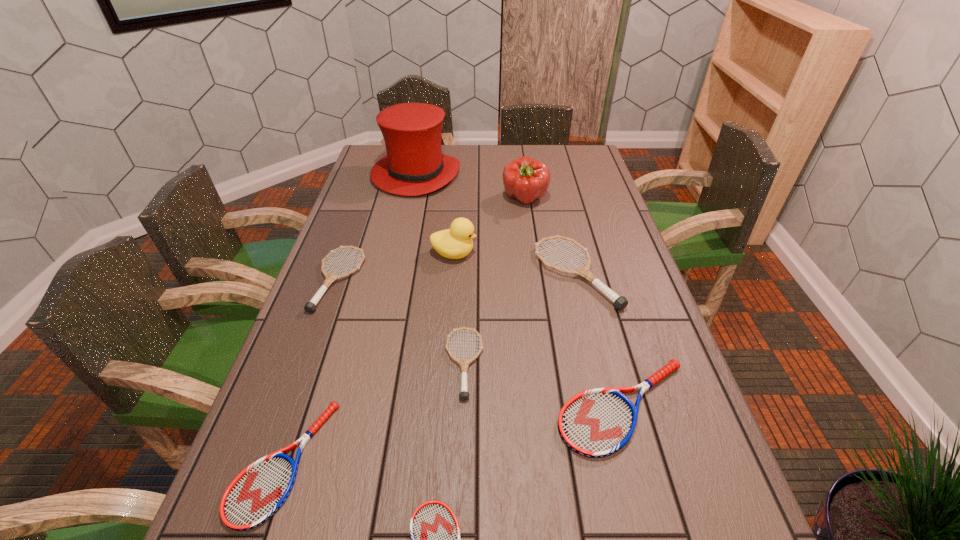
Choose which gray tennis racket is the second nearest neighbor to the fourth tallest object. Please provide its 2D coordinates. Your answer should be formatted as a tuple, i.e. [(x, y)], where the tuple contains the x and y coordinates of a point satisfying the conditions above.

[(310, 307)]

Identify which gray tennis racket is the second nearest to the smallest gray tennis racket. Please provide its 2D coordinates. Your answer should be formatted as a tuple, i.e. [(x, y)], where the tuple contains the x and y coordinates of a point satisfying the conditions above.

[(310, 307)]

The width and height of the screenshot is (960, 540). What are the coordinates of `blue tennis racket that is the third closest to the rightmost gray tennis racket` in the screenshot? It's located at (258, 492).

Point out which blue tennis racket is positioned as the nearest to the nearest gray tennis racket. Please provide its 2D coordinates. Your answer should be formatted as a tuple, i.e. [(x, y)], where the tuple contains the x and y coordinates of a point satisfying the conditions above.

[(596, 423)]

This screenshot has width=960, height=540. I want to click on vacant point that satisfies the following two spatial constraints: 1. on the front-facing side of the duck; 2. on the back side of the nearest gray tennis racket, so click(x=446, y=363).

Identify the location of vacant space that satisfies the following two spatial constraints: 1. on the front side of the biggest gray tennis racket; 2. on the right side of the hat. The width and height of the screenshot is (960, 540). point(395,274).

Where is `free point that satisfies the following two spatial constraints: 1. on the front-facing side of the duck; 2. on the right side of the biggest gray tennis racket`? The width and height of the screenshot is (960, 540). free point that satisfies the following two spatial constraints: 1. on the front-facing side of the duck; 2. on the right side of the biggest gray tennis racket is located at coordinates (452, 274).